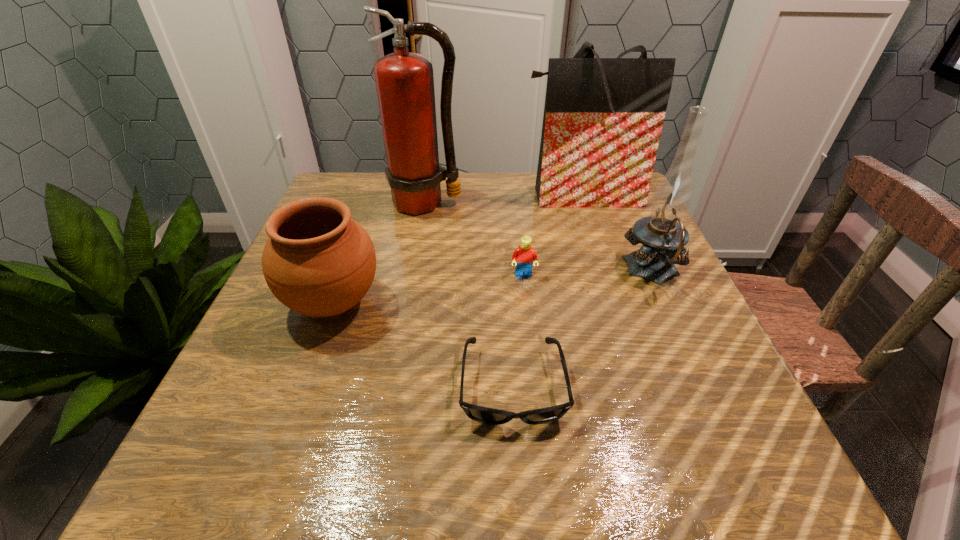
I want to click on free space that is in between the Lego and the pottery, so click(x=428, y=289).

You are a GUI agent. You are given a task and a screenshot of the screen. Output one action in this format:
    pyautogui.click(x=<x>, y=<y>)
    Task: Click on the empty space between the nearest object and the Lego
    
    Given the screenshot: What is the action you would take?
    pyautogui.click(x=518, y=331)

Locate an element on the screen. This screenshot has width=960, height=540. vacant area that lies between the Lego and the fourth tallest object is located at coordinates (428, 289).

Find the location of a particular element. free spot between the oil lamp and the fire extinguisher is located at coordinates (539, 237).

The height and width of the screenshot is (540, 960). What are the coordinates of `free space between the pottery and the shopping bag` in the screenshot? It's located at (457, 249).

Identify which object is located as the fifth nearest to the sunglasses. Please provide its 2D coordinates. Your answer should be formatted as a tuple, i.e. [(x, y)], where the tuple contains the x and y coordinates of a point satisfying the conditions above.

[(603, 117)]

Point out which object is positioned as the second nearest to the fourth tallest object. Please provide its 2D coordinates. Your answer should be formatted as a tuple, i.e. [(x, y)], where the tuple contains the x and y coordinates of a point satisfying the conditions above.

[(404, 81)]